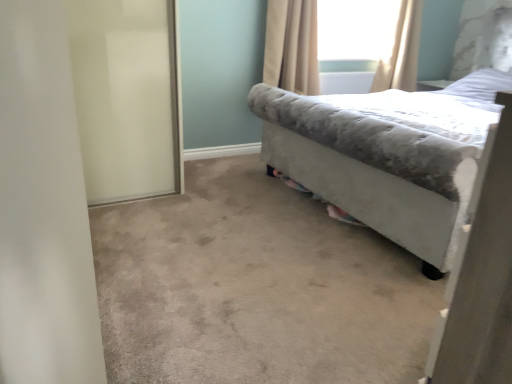
Describe the element at coordinates (401, 51) in the screenshot. I see `beige fabric curtain at upper right, the second curtain positioned from the left` at that location.

Measure the distance between point (270, 33) and camera.

10.33 feet.

This screenshot has width=512, height=384. What do you see at coordinates (126, 97) in the screenshot? I see `white frosted glass screen door at left` at bounding box center [126, 97].

I want to click on beige fabric curtain at upper right, which is counted as the first curtain, starting from the right, so click(x=401, y=51).

Is transparent glass window screen at upper center far away from beige fabric curtain at upper right, which is counted as the first curtain, starting from the right?

transparent glass window screen at upper center is near beige fabric curtain at upper right, which is counted as the first curtain, starting from the right, not far away.

The image size is (512, 384). In the image, there is a beige fabric curtain at upper right, the second curtain positioned from the left. Find the location of `window screen above it (from the image's perspective)`. window screen above it (from the image's perspective) is located at coordinates (355, 33).

Relative to beige fabric curtain at upper right, the second curtain positioned from the left, is transparent glass window screen at upper center in front or behind?

Visually, transparent glass window screen at upper center is located behind beige fabric curtain at upper right, the second curtain positioned from the left.

Does beige fabric curtain at upper right, which is counted as the first curtain, starting from the right, have a lesser height compared to beige fabric curtain at upper center, marked as the first curtain in a left-to-right arrangement?

Indeed, beige fabric curtain at upper right, which is counted as the first curtain, starting from the right, has a lesser height compared to beige fabric curtain at upper center, marked as the first curtain in a left-to-right arrangement.

Is beige fabric curtain at upper center, the 2th curtain in the right-to-left sequence, at the back of beige fabric curtain at upper right, which is counted as the first curtain, starting from the right?

That's not correct — beige fabric curtain at upper right, which is counted as the first curtain, starting from the right, is not looking away from beige fabric curtain at upper center, the 2th curtain in the right-to-left sequence.

Could you measure the distance between beige fabric curtain at upper right, the second curtain positioned from the left, and beige fabric curtain at upper center, marked as the first curtain in a left-to-right arrangement?

beige fabric curtain at upper right, the second curtain positioned from the left, is 89.31 centimeters away from beige fabric curtain at upper center, marked as the first curtain in a left-to-right arrangement.

Does beige fabric curtain at upper right, which is counted as the first curtain, starting from the right, have a lesser width compared to beige fabric curtain at upper center, marked as the first curtain in a left-to-right arrangement?

Incorrect, the width of beige fabric curtain at upper right, which is counted as the first curtain, starting from the right, is not less than that of beige fabric curtain at upper center, marked as the first curtain in a left-to-right arrangement.

Does transparent glass window screen at upper center have a lesser height compared to velvet gray bed at right?

Yes.

Considering the relative sizes of transparent glass window screen at upper center and velvet gray bed at right in the image provided, is transparent glass window screen at upper center bigger than velvet gray bed at right?

No, transparent glass window screen at upper center is not bigger than velvet gray bed at right.

Who is more distant, transparent glass window screen at upper center or velvet gray bed at right?

Positioned behind is transparent glass window screen at upper center.

From the image's perspective, which is above, transparent glass window screen at upper center or velvet gray bed at right?

transparent glass window screen at upper center is shown above in the image.

Is white frosted glass screen door at left not near beige fabric curtain at upper center, marked as the first curtain in a left-to-right arrangement?

Indeed, white frosted glass screen door at left is not near beige fabric curtain at upper center, marked as the first curtain in a left-to-right arrangement.

Between white frosted glass screen door at left and beige fabric curtain at upper center, marked as the first curtain in a left-to-right arrangement, which one has smaller size?

beige fabric curtain at upper center, marked as the first curtain in a left-to-right arrangement, is smaller.

Which is closer, (121,45) or (309,70)?

Point (121,45).

In the scene shown: From a real-world perspective, who is located higher, transparent glass window screen at upper center or beige fabric curtain at upper center, marked as the first curtain in a left-to-right arrangement?

transparent glass window screen at upper center, from a real-world perspective.

Based on their sizes in the image, would you say transparent glass window screen at upper center is bigger or smaller than beige fabric curtain at upper center, the 2th curtain in the right-to-left sequence?

In the image, transparent glass window screen at upper center appears to be smaller than beige fabric curtain at upper center, the 2th curtain in the right-to-left sequence.

Who is more distant, transparent glass window screen at upper center or beige fabric curtain at upper center, marked as the first curtain in a left-to-right arrangement?

transparent glass window screen at upper center.

From the image's perspective, between transparent glass window screen at upper center and beige fabric curtain at upper center, marked as the first curtain in a left-to-right arrangement, which one is located above?

transparent glass window screen at upper center appears higher in the image.

Considering the sizes of velvet gray bed at right and transparent glass window screen at upper center in the image, is velvet gray bed at right bigger or smaller than transparent glass window screen at upper center?

In the image, velvet gray bed at right appears to be larger than transparent glass window screen at upper center.

From a real-world perspective, is velvet gray bed at right positioned above or below transparent glass window screen at upper center?

From a real-world perspective, velvet gray bed at right is physically below transparent glass window screen at upper center.

Can you confirm if velvet gray bed at right is shorter than transparent glass window screen at upper center?

Incorrect, the height of velvet gray bed at right does not fall short of that of transparent glass window screen at upper center.

From the image's perspective, which is above, velvet gray bed at right or transparent glass window screen at upper center?

From the image's view, transparent glass window screen at upper center is above.

Would you say beige fabric curtain at upper center, the 2th curtain in the right-to-left sequence, is inside or outside beige fabric curtain at upper right, which is counted as the first curtain, starting from the right?

beige fabric curtain at upper center, the 2th curtain in the right-to-left sequence, is spatially situated outside beige fabric curtain at upper right, which is counted as the first curtain, starting from the right.

Is beige fabric curtain at upper center, the 2th curtain in the right-to-left sequence, facing towards beige fabric curtain at upper right, the second curtain positioned from the left?

No, beige fabric curtain at upper center, the 2th curtain in the right-to-left sequence, is not turned towards beige fabric curtain at upper right, the second curtain positioned from the left.

Does beige fabric curtain at upper center, marked as the first curtain in a left-to-right arrangement, lie in front of beige fabric curtain at upper right, which is counted as the first curtain, starting from the right?

Yes, it is in front of beige fabric curtain at upper right, which is counted as the first curtain, starting from the right.

Where is `the 1st curtain below the transparent glass window screen at upper center (from a real-world perspective)`? The width and height of the screenshot is (512, 384). the 1st curtain below the transparent glass window screen at upper center (from a real-world perspective) is located at coordinates (401, 51).

Locate an element on the screen. curtain in front of the beige fabric curtain at upper right, the second curtain positioned from the left is located at coordinates (292, 46).

When comparing their distances from beige fabric curtain at upper center, marked as the first curtain in a left-to-right arrangement, does white frosted glass screen door at left or beige fabric curtain at upper right, which is counted as the first curtain, starting from the right, seem closer?

Among the two, beige fabric curtain at upper right, which is counted as the first curtain, starting from the right, is located nearer to beige fabric curtain at upper center, marked as the first curtain in a left-to-right arrangement.

Which object lies further to the anchor point transparent glass window screen at upper center, velvet gray bed at right or white frosted glass screen door at left?

white frosted glass screen door at left is further to transparent glass window screen at upper center.

From the picture: Which object lies nearer to the anchor point beige fabric curtain at upper right, the second curtain positioned from the left, transparent glass window screen at upper center or white frosted glass screen door at left?

Based on the image, transparent glass window screen at upper center appears to be nearer to beige fabric curtain at upper right, the second curtain positioned from the left.

Based on their spatial positions, is beige fabric curtain at upper center, the 2th curtain in the right-to-left sequence, or transparent glass window screen at upper center further from white frosted glass screen door at left?

Among the two, transparent glass window screen at upper center is located further to white frosted glass screen door at left.

Which object lies nearer to the anchor point velvet gray bed at right, beige fabric curtain at upper right, the second curtain positioned from the left, or transparent glass window screen at upper center?

beige fabric curtain at upper right, the second curtain positioned from the left, is positioned closer to the anchor velvet gray bed at right.

Based on their spatial positions, is velvet gray bed at right or transparent glass window screen at upper center further from white frosted glass screen door at left?

transparent glass window screen at upper center is positioned further to the anchor white frosted glass screen door at left.

Based on the photo, from the image, which object appears to be farther from beige fabric curtain at upper center, the 2th curtain in the right-to-left sequence, velvet gray bed at right or beige fabric curtain at upper right, which is counted as the first curtain, starting from the right?

Based on the image, velvet gray bed at right appears to be further to beige fabric curtain at upper center, the 2th curtain in the right-to-left sequence.

Looking at the image, which one is located closer to velvet gray bed at right, beige fabric curtain at upper center, marked as the first curtain in a left-to-right arrangement, or white frosted glass screen door at left?

beige fabric curtain at upper center, marked as the first curtain in a left-to-right arrangement, is closer to velvet gray bed at right.

In order to click on window screen between beige fabric curtain at upper center, marked as the first curtain in a left-to-right arrangement, and beige fabric curtain at upper right, the second curtain positioned from the left in this screenshot , I will do `click(355, 33)`.

The width and height of the screenshot is (512, 384). In order to click on curtain located between white frosted glass screen door at left and beige fabric curtain at upper right, which is counted as the first curtain, starting from the right, in the left-right direction in this screenshot , I will do `click(292, 46)`.

Where is `curtain between white frosted glass screen door at left and transparent glass window screen at upper center in the horizontal direction`? curtain between white frosted glass screen door at left and transparent glass window screen at upper center in the horizontal direction is located at coordinates (292, 46).

Identify the location of curtain between velvet gray bed at right and beige fabric curtain at upper right, the second curtain positioned from the left, along the z-axis. (292, 46).